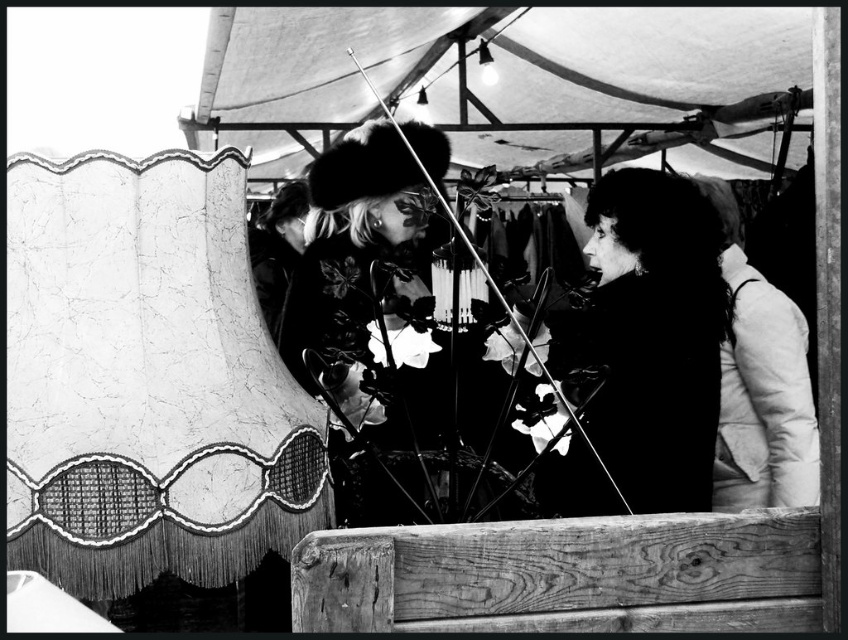
Between silky black hair at center and white puffy jacket at right, which one appears on the right side from the viewer's perspective?

From the viewer's perspective, white puffy jacket at right appears more on the right side.

Measure the distance between point (653,497) and camera.

Point (653,497) and camera are 3.22 meters apart.

What do you see at coordinates (651, 337) in the screenshot?
I see `silky black hair at center` at bounding box center [651, 337].

The width and height of the screenshot is (848, 640). Identify the location of silky black hair at center. (651, 337).

Does white fabric canopy at upper center have a greater height compared to white puffy jacket at right?

No, white fabric canopy at upper center is not taller than white puffy jacket at right.

Which is below, white fabric canopy at upper center or white puffy jacket at right?

white puffy jacket at right is lower down.

Between point (293, 100) and point (789, 321), which one is positioned in front?

Point (789, 321) is in front.

Where is `white fabric canopy at upper center`? white fabric canopy at upper center is located at coordinates (498, 74).

Can you confirm if white fabric canopy at upper center is wider than silky black hair at center?

Yes.

Identify the location of white fabric canopy at upper center. (498, 74).